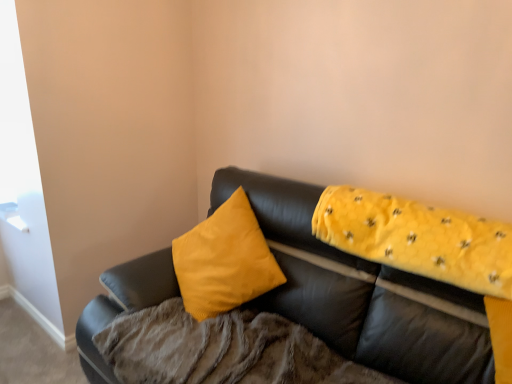
What do you see at coordinates (418, 238) in the screenshot? I see `yellow quilted fabric at upper right` at bounding box center [418, 238].

The height and width of the screenshot is (384, 512). Identify the location of matte black couch at center. (362, 294).

Between soft yellow blanket at upper right and matte black couch at center, which one has larger size?

matte black couch at center is bigger.

Is matte black couch at center at the back of soft yellow blanket at upper right?

Yes, soft yellow blanket at upper right's orientation is away from matte black couch at center.

From the image's perspective, who appears lower, soft yellow blanket at upper right or matte black couch at center?

soft yellow blanket at upper right.

Based on the photo, considering the positions of objects soft yellow blanket at upper right and matte black couch at center in the image provided, who is in front, soft yellow blanket at upper right or matte black couch at center?

Positioned in front is matte black couch at center.

From the image's perspective, does yellow quilted fabric at upper right appear lower than soft yellow blanket at upper right?

No.

Is yellow quilted fabric at upper right shorter than soft yellow blanket at upper right?

Correct, yellow quilted fabric at upper right is not as tall as soft yellow blanket at upper right.

Find the location of a particular element. This screenshot has width=512, height=384. blanket on the right of soft yellow blanket at upper right is located at coordinates (418, 238).

Between yellow quilted fabric at upper right and soft yellow blanket at upper right, which one is positioned behind?

Positioned behind is yellow quilted fabric at upper right.

From the image's perspective, which one is positioned lower, soft yellow blanket at upper right or yellow quilted fabric at upper right?

soft yellow blanket at upper right.

Does soft yellow blanket at upper right appear on the left side of yellow quilted fabric at upper right?

Yes.

How many degrees apart are the facing directions of soft yellow blanket at upper right and yellow quilted fabric at upper right?

0.000391 degrees separate the facing orientations of soft yellow blanket at upper right and yellow quilted fabric at upper right.

Can you see matte black couch at center touching yellow quilted fabric at upper right?

They are not placed beside each other.

In the image, is matte black couch at center positioned in front of or behind yellow quilted fabric at upper right?

matte black couch at center is in front of yellow quilted fabric at upper right.

Would you say matte black couch at center is outside yellow quilted fabric at upper right?

Yes, matte black couch at center is outside of yellow quilted fabric at upper right.

Considering the positions of points (490, 362) and (420, 215), is point (490, 362) farther from camera compared to point (420, 215)?

No, (490, 362) is in front of (420, 215).

Does yellow quilted fabric at upper right have a smaller size compared to matte black couch at center?

Correct, yellow quilted fabric at upper right occupies less space than matte black couch at center.

Considering the positions of objects yellow quilted fabric at upper right and matte black couch at center in the image provided, who is behind, yellow quilted fabric at upper right or matte black couch at center?

yellow quilted fabric at upper right is behind.

From the image's perspective, is yellow quilted fabric at upper right above matte black couch at center?

Yes.

Which object is positioned more to the left, matte black couch at center or soft yellow blanket at upper right?

From the viewer's perspective, soft yellow blanket at upper right appears more on the left side.

Is point (467, 377) closer or farther from the camera than point (300, 377)?

Point (467, 377) is closer to the camera than point (300, 377).

From the picture: Can you tell me how much matte black couch at center and soft yellow blanket at upper right differ in facing direction?

0.000242 degrees.

Who is bigger, matte black couch at center or soft yellow blanket at upper right?

matte black couch at center is bigger.

The image size is (512, 384). Find the location of `bedding located behind the matte black couch at center`. bedding located behind the matte black couch at center is located at coordinates (222, 350).

Locate an element on the screen. This screenshot has height=384, width=512. bedding located on the left of yellow quilted fabric at upper right is located at coordinates (222, 350).

Looking at the image, which one is located closer to yellow quilted fabric at upper right, matte black couch at center or soft yellow blanket at upper right?

matte black couch at center is closer to yellow quilted fabric at upper right.

From the image, which object appears to be nearer to yellow quilted fabric at upper right, soft yellow blanket at upper right or matte black couch at center?

Based on the image, matte black couch at center appears to be nearer to yellow quilted fabric at upper right.

When comparing their distances from soft yellow blanket at upper right, does matte black couch at center or yellow quilted fabric at upper right seem closer?

Among the two, matte black couch at center is located nearer to soft yellow blanket at upper right.

When comparing their distances from matte black couch at center, does yellow quilted fabric at upper right or soft yellow blanket at upper right seem further?

Based on the image, soft yellow blanket at upper right appears to be further to matte black couch at center.

Considering their positions, is yellow quilted fabric at upper right positioned closer to soft yellow blanket at upper right than matte black couch at center?

The object closer to soft yellow blanket at upper right is matte black couch at center.

Estimate the real-world distances between objects in this image. Which object is closer to matte black couch at center, soft yellow blanket at upper right or yellow quilted fabric at upper right?

The object closer to matte black couch at center is yellow quilted fabric at upper right.

Identify the location of studio couch situated between soft yellow blanket at upper right and yellow quilted fabric at upper right from left to right. (362, 294).